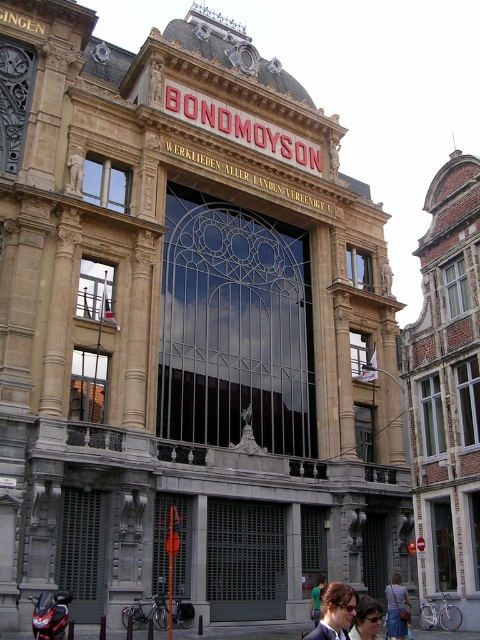
Can you confirm if dark brown hair at center is positioned below matte black sunglasses at lower center?

No, dark brown hair at center is not below matte black sunglasses at lower center.

Does dark brown hair at center lie behind matte black sunglasses at lower center?

No.

Who is more distant from viewer, (x=327, y=600) or (x=359, y=632)?

The point (x=359, y=632) is behind.

Locate an element on the screen. dark brown hair at center is located at coordinates (335, 612).

Which is below, denim jacket at lower right or matte black sunglasses at lower center?

denim jacket at lower right is lower down.

Is denim jacket at lower right smaller than matte black sunglasses at lower center?

Yes.

Locate an element on the screen. The height and width of the screenshot is (640, 480). denim jacket at lower right is located at coordinates [396, 609].

Which of these two, dark brown hair at center or denim jacket at lower right, stands shorter?

With less height is denim jacket at lower right.

Between point (322, 605) and point (400, 628), which one is positioned behind?

The point (322, 605) is behind.

The image size is (480, 640). What are the coordinates of `dark brown hair at center` in the screenshot? It's located at [x=335, y=612].